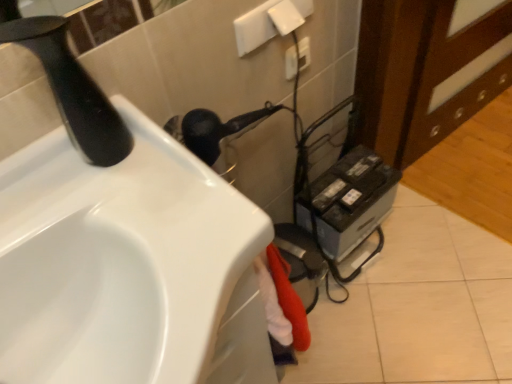
Question: From their relative heights in the image, would you say black matte faucet at upper left is taller or shorter than metallic gray printer at lower right?

Choices:
 (A) short
 (B) tall

Answer: (B)

Question: Which is correct: black matte faucet at upper left is inside metallic gray printer at lower right, or outside of it?

Choices:
 (A) inside
 (B) outside

Answer: (B)

Question: Considering the real-world distances, which object is farthest from the white glossy sink at lower left?

Choices:
 (A) metallic gray printer at lower right
 (B) black matte faucet at upper left
 (C) white plastic electric outlet at upper center

Answer: (C)

Question: Considering the real-world distances, which object is farthest from the metallic gray printer at lower right?

Choices:
 (A) black matte faucet at upper left
 (B) white plastic electric outlet at upper center
 (C) white glossy sink at lower left

Answer: (A)